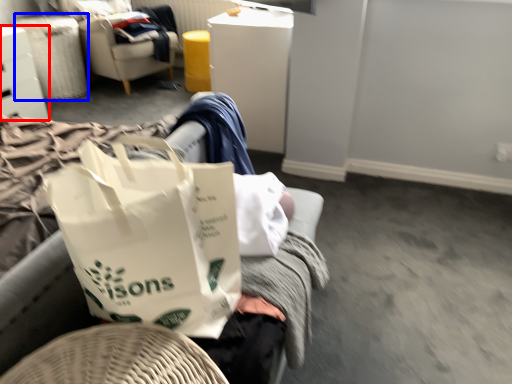
Question: Which point is closer to the camera, furniture (highlighted by a red box) or laundry basket (highlighted by a blue box)?

Choices:
 (A) furniture
 (B) laundry basket

Answer: (A)